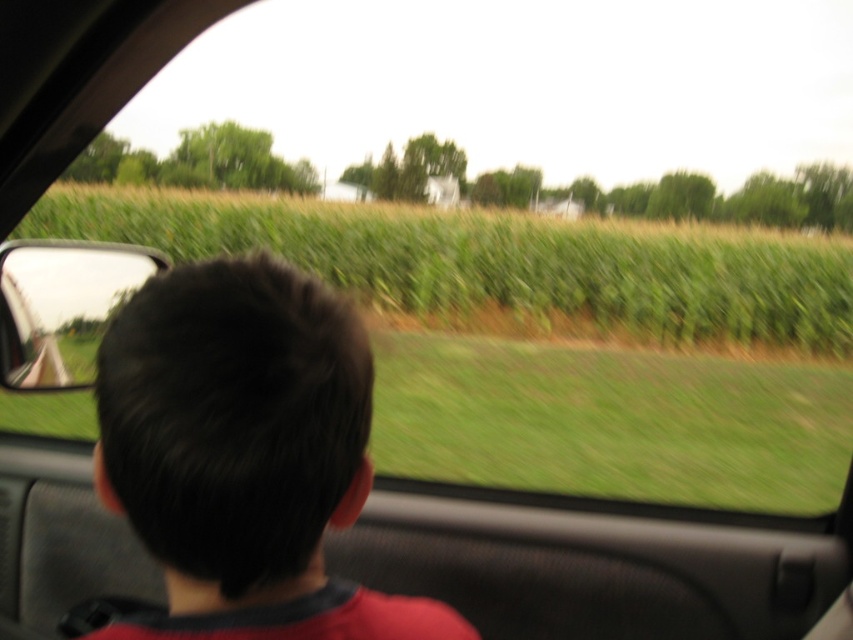
You are sitting in the driver seat of a car and looking forward. You see the dark brown hair at center and the green grassy field at center. Which one is positioned to the left side from your viewpoint?

The dark brown hair at center is to the left of green grassy field at center, so the dark brown hair at center is positioned to the left side from your viewpoint.